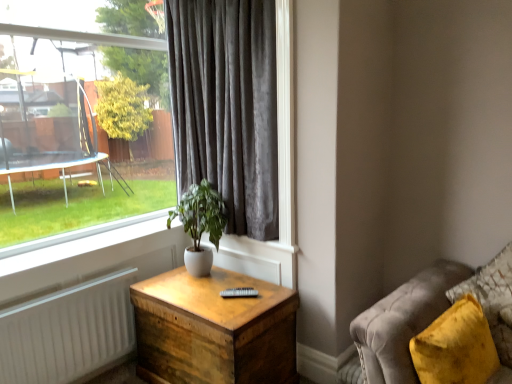
Question: Relative to velvet gray curtain at center, is velvet yellow pillow at lower right in front or behind?

Choices:
 (A) front
 (B) behind

Answer: (A)

Question: In terms of width, does velvet yellow pillow at lower right look wider or thinner when compared to velvet gray curtain at center?

Choices:
 (A) wide
 (B) thin

Answer: (A)

Question: Which of these objects is positioned farthest from the white ceramic plant at center?

Choices:
 (A) white matte radiator at lower left
 (B) velvet yellow pillow at lower right
 (C) velvet gray curtain at center
 (D) wooden nightstand at center
 (E) clear glass window at upper left

Answer: (B)

Question: Which object is the farthest from the white matte radiator at lower left?

Choices:
 (A) clear glass window at upper left
 (B) velvet yellow pillow at lower right
 (C) velvet gray curtain at center
 (D) velvet yellow pillow at lower right
 (E) white ceramic plant at center

Answer: (B)